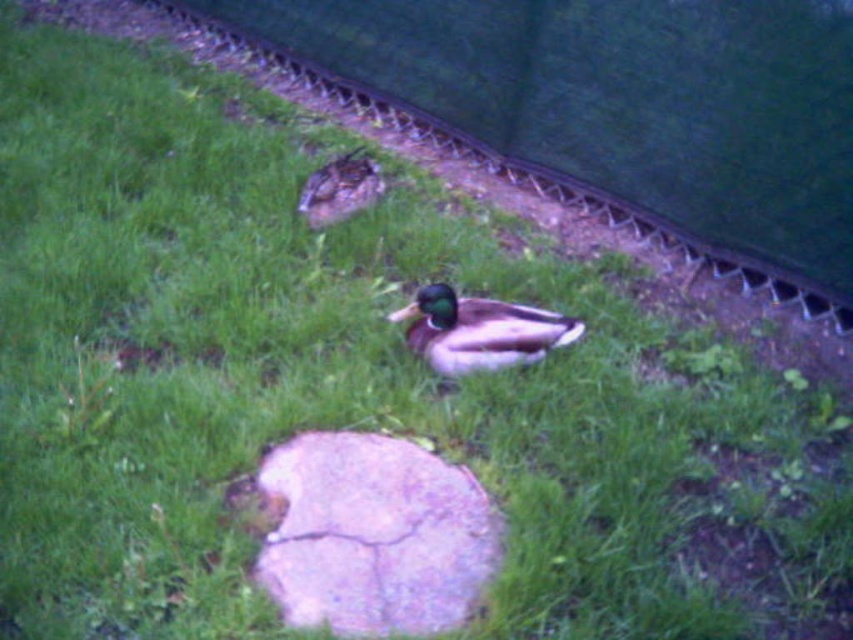
Question: Which object appears farthest from the camera in this image?

Choices:
 (A) green matte duck at center
 (B) purple cracked rock at center

Answer: (A)

Question: Observing the image, what is the correct spatial positioning of purple cracked rock at center in reference to green matte duck at center?

Choices:
 (A) left
 (B) right

Answer: (A)

Question: Which of the following is the farthest from the observer?

Choices:
 (A) (448, 364)
 (B) (328, 508)

Answer: (A)

Question: From the image, what is the correct spatial relationship of purple cracked rock at center in relation to green matte duck at center?

Choices:
 (A) below
 (B) above

Answer: (A)

Question: Does purple cracked rock at center come in front of green matte duck at center?

Choices:
 (A) yes
 (B) no

Answer: (A)